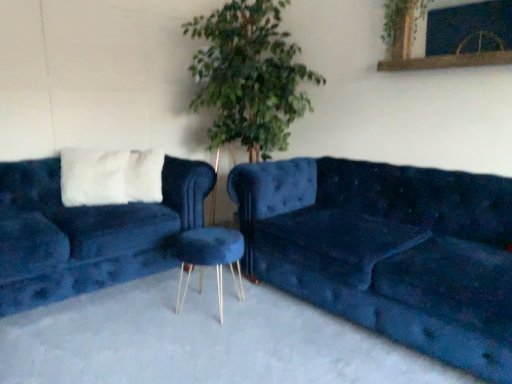
Question: Is velvet blue couch at left, arranged as the 1th studio couch when viewed from the left, wider than green leafy plant at upper center?

Choices:
 (A) yes
 (B) no

Answer: (A)

Question: Would you say green leafy plant at upper center is part of velvet blue couch at left, acting as the second studio couch starting from the right,'s contents?

Choices:
 (A) no
 (B) yes

Answer: (A)

Question: Is velvet blue couch at left, acting as the second studio couch starting from the right, at the right side of green leafy plant at upper center?

Choices:
 (A) yes
 (B) no

Answer: (B)

Question: Is velvet blue couch at left, arranged as the 1th studio couch when viewed from the left, bigger than green leafy plant at upper center?

Choices:
 (A) yes
 (B) no

Answer: (A)

Question: Is velvet blue couch at left, arranged as the 1th studio couch when viewed from the left, shorter than green leafy plant at upper center?

Choices:
 (A) no
 (B) yes

Answer: (A)

Question: Is the depth of velvet blue couch at left, acting as the second studio couch starting from the right, less than that of green leafy plant at upper center?

Choices:
 (A) yes
 (B) no

Answer: (A)

Question: Is velvet blue couch at right, which appears as the first studio couch when viewed from the right, taller than green leafy plant at upper center?

Choices:
 (A) no
 (B) yes

Answer: (B)

Question: Is green leafy plant at upper center surrounded by velvet blue couch at right, which is counted as the second studio couch, starting from the left?

Choices:
 (A) no
 (B) yes

Answer: (A)

Question: Does velvet blue couch at right, which is counted as the second studio couch, starting from the left, have a lesser height compared to green leafy plant at upper center?

Choices:
 (A) yes
 (B) no

Answer: (B)

Question: From the image's perspective, is velvet blue couch at right, which is counted as the second studio couch, starting from the left, under green leafy plant at upper center?

Choices:
 (A) no
 (B) yes

Answer: (B)

Question: Considering the relative positions of velvet blue couch at right, which is counted as the second studio couch, starting from the left, and green leafy plant at upper center in the image provided, is velvet blue couch at right, which is counted as the second studio couch, starting from the left, behind green leafy plant at upper center?

Choices:
 (A) no
 (B) yes

Answer: (A)

Question: Does velvet blue couch at right, which appears as the first studio couch when viewed from the right, have a greater width compared to green leafy plant at upper center?

Choices:
 (A) no
 (B) yes

Answer: (B)

Question: Considering the relative sizes of velvet blue couch at left, acting as the second studio couch starting from the right, and velvet blue stool at center in the image provided, is velvet blue couch at left, acting as the second studio couch starting from the right, shorter than velvet blue stool at center?

Choices:
 (A) no
 (B) yes

Answer: (A)